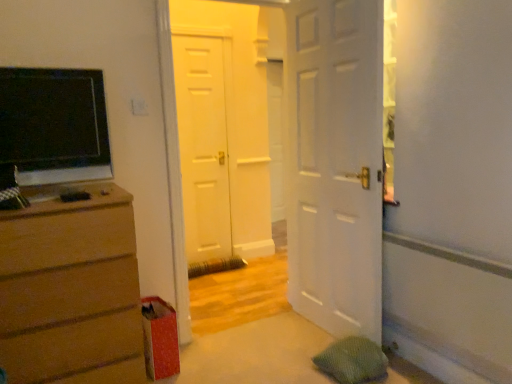
Question: Based on their sizes in the image, would you say white matte door at center, placed as the third door when sorted from front to back, is bigger or smaller than white matte door at center, the 2th door from the front?

Choices:
 (A) big
 (B) small

Answer: (B)

Question: In the image, is white matte door at center, placed as the third door when sorted from front to back, positioned in front of or behind white matte door at center, the 2th door positioned from the back?

Choices:
 (A) front
 (B) behind

Answer: (B)

Question: Which object is positioned closest to the white matte door at center, the 2th door from the front?

Choices:
 (A) white matte door at center, placed as the third door when sorted from front to back
 (B) white matte door at center, the 1th door in the front-to-back sequence
 (C) matte brown dresser at left

Answer: (A)

Question: Which object is the closest to the white matte door at center, the 2th door positioned from the back?

Choices:
 (A) white matte door at center, the 1th door in the front-to-back sequence
 (B) white matte door at center, placed as the third door when sorted from front to back
 (C) matte brown dresser at left

Answer: (B)